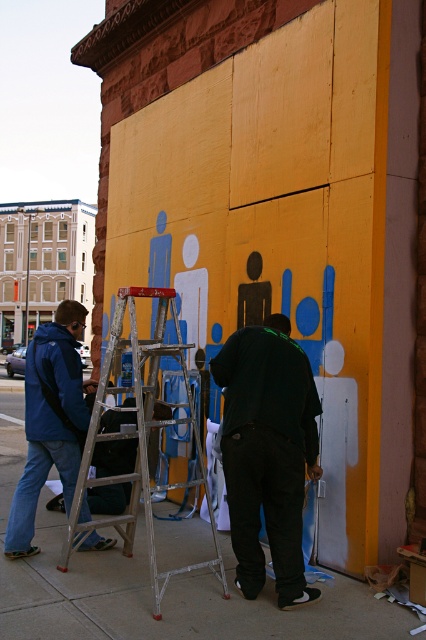
Does dark green shirt at center have a smaller size compared to silver metallic ladder at center?

Correct, dark green shirt at center occupies less space than silver metallic ladder at center.

Is dark green shirt at center behind silver metallic ladder at center?

That is True.

You are a GUI agent. You are given a task and a screenshot of the screen. Output one action in this format:
    pyautogui.click(x=<x>, y=<y>)
    Task: Click on the dark green shirt at center
    
    Given the screenshot: What is the action you would take?
    click(267, 452)

Identify the location of concrete sidewalk at lower center. The image size is (426, 640). (170, 600).

Is concrete sidewalk at lower center below blue matte jacket at left?

Indeed, concrete sidewalk at lower center is positioned under blue matte jacket at left.

You are a GUI agent. You are given a task and a screenshot of the screen. Output one action in this format:
    pyautogui.click(x=<x>, y=<y>)
    Task: Click on the concrete sidewalk at lower center
    The image size is (426, 640).
    Given the screenshot: What is the action you would take?
    pyautogui.click(x=170, y=600)

The image size is (426, 640). I want to click on concrete sidewalk at lower center, so click(x=170, y=600).

Is concrete sidewalk at lower center below silver metallic ladder at center?

Correct, concrete sidewalk at lower center is located below silver metallic ladder at center.

Describe the element at coordinates (170, 600) in the screenshot. I see `concrete sidewalk at lower center` at that location.

Does point (94, 604) lie behind point (152, 516)?

Yes, it is behind point (152, 516).

Where is `concrete sidewalk at lower center`? This screenshot has height=640, width=426. concrete sidewalk at lower center is located at coordinates (170, 600).